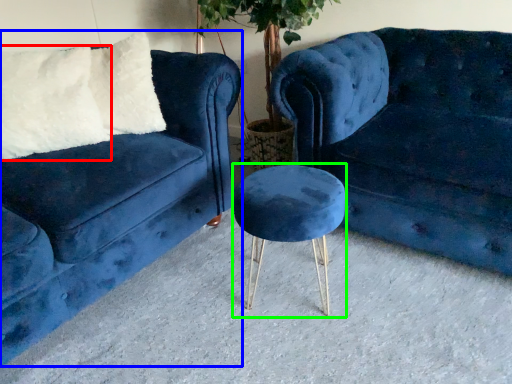
Question: Which is farther away from pillow (highlighted by a red box)? studio couch (highlighted by a blue box) or bar stool (highlighted by a green box)?

Choices:
 (A) studio couch
 (B) bar stool

Answer: (B)